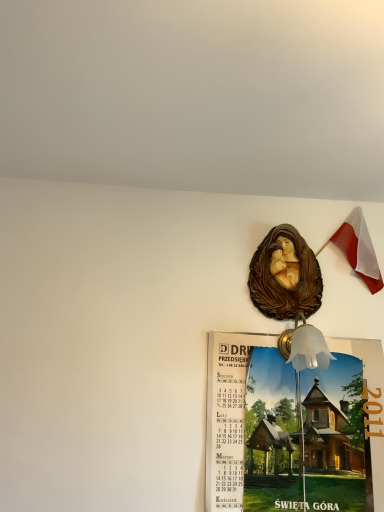
Question: From the image's perspective, does wooden calendar at center appear lower than brown glossy statue at upper center?

Choices:
 (A) no
 (B) yes

Answer: (B)

Question: Does wooden calendar at center have a smaller size compared to brown glossy statue at upper center?

Choices:
 (A) yes
 (B) no

Answer: (B)

Question: Considering the relative sizes of wooden calendar at center and brown glossy statue at upper center in the image provided, is wooden calendar at center shorter than brown glossy statue at upper center?

Choices:
 (A) no
 (B) yes

Answer: (A)

Question: Is there a large distance between wooden calendar at center and brown glossy statue at upper center?

Choices:
 (A) yes
 (B) no

Answer: (B)

Question: Is wooden calendar at center at the right side of brown glossy statue at upper center?

Choices:
 (A) no
 (B) yes

Answer: (A)

Question: In terms of size, does wooden calendar at center appear bigger or smaller than brown glossy statue at upper center?

Choices:
 (A) small
 (B) big

Answer: (B)

Question: Is point click(x=334, y=382) positioned closer to the camera than point click(x=304, y=250)?

Choices:
 (A) closer
 (B) farther

Answer: (A)

Question: Considering their positions, is wooden calendar at center located in front of or behind brown glossy statue at upper center?

Choices:
 (A) front
 (B) behind

Answer: (A)

Question: In terms of height, does wooden calendar at center look taller or shorter compared to brown glossy statue at upper center?

Choices:
 (A) short
 (B) tall

Answer: (B)

Question: Is polish flag at upper right spatially inside wooden calendar at center, or outside of it?

Choices:
 (A) inside
 (B) outside

Answer: (B)

Question: In terms of size, does polish flag at upper right appear bigger or smaller than wooden calendar at center?

Choices:
 (A) small
 (B) big

Answer: (A)

Question: Is polish flag at upper right in front of or behind wooden calendar at center in the image?

Choices:
 (A) front
 (B) behind

Answer: (B)

Question: From the image's perspective, relative to wooden calendar at center, is polish flag at upper right above or below?

Choices:
 (A) above
 (B) below

Answer: (A)

Question: In terms of width, does polish flag at upper right look wider or thinner when compared to brown glossy statue at upper center?

Choices:
 (A) wide
 (B) thin

Answer: (B)

Question: From the image's perspective, is polish flag at upper right located above or below brown glossy statue at upper center?

Choices:
 (A) above
 (B) below

Answer: (A)